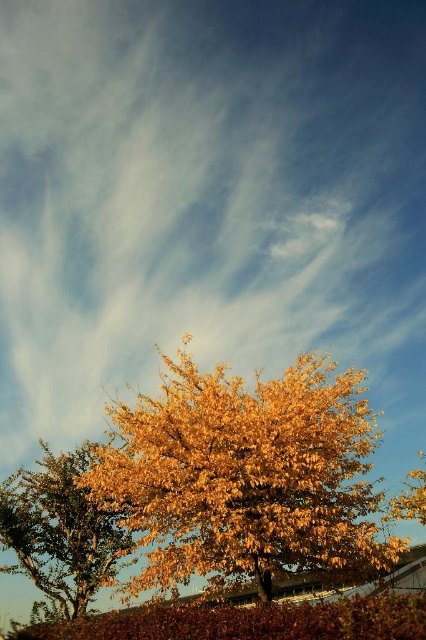
Question: Among these objects, which one is farthest from the camera?

Choices:
 (A) golden textured leaves at lower left
 (B) golden leafy tree at center

Answer: (A)

Question: Is golden leafy tree at center further to the viewer compared to golden textured leaves at lower left?

Choices:
 (A) yes
 (B) no

Answer: (B)

Question: Which object appears closest to the camera in this image?

Choices:
 (A) golden textured leaves at lower left
 (B) golden leafy tree at center

Answer: (B)

Question: Does golden leafy tree at center have a larger size compared to golden textured leaves at lower left?

Choices:
 (A) yes
 (B) no

Answer: (B)

Question: Among these points, which one is farthest from the camera?

Choices:
 (A) (92, 550)
 (B) (328, 392)

Answer: (A)

Question: Can you confirm if golden leafy tree at center is bigger than golden textured leaves at lower left?

Choices:
 (A) no
 (B) yes

Answer: (A)